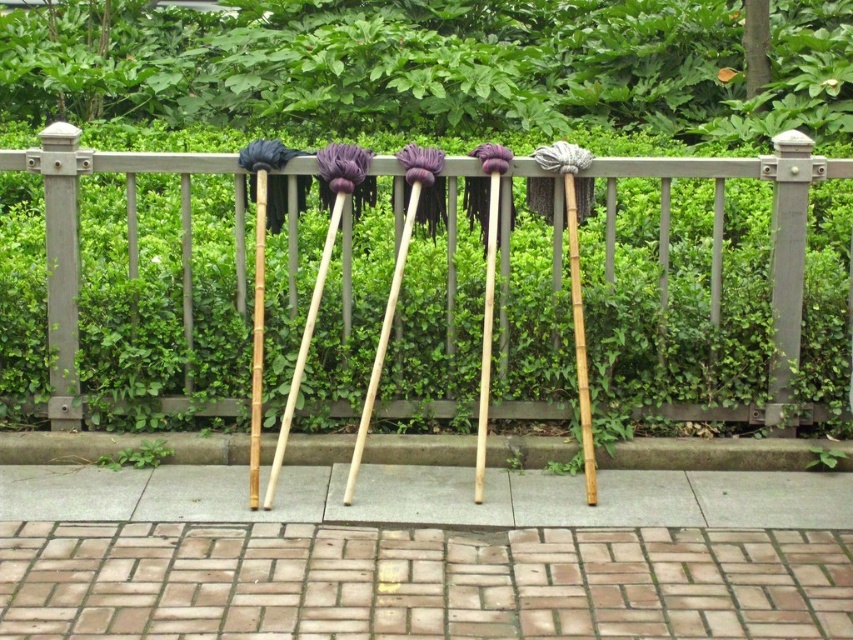
What do you see at coordinates (596, 291) in the screenshot?
I see `wooden fence at center` at bounding box center [596, 291].

Is wooden fence at center positioned in front of green leafy hedge at upper center?

Yes, wooden fence at center is in front of green leafy hedge at upper center.

Between point (152, 211) and point (521, 35), which one is positioned in front?

Positioned in front is point (152, 211).

Locate an element on the screen. The image size is (853, 640). wooden fence at center is located at coordinates (596, 291).

Between green leafy hedge at upper center and brick paving at lower center, which one is positioned lower?

brick paving at lower center

Is green leafy hedge at upper center shorter than brick paving at lower center?

No, green leafy hedge at upper center is not shorter than brick paving at lower center.

Does point (233, 12) lie behind point (219, 609)?

Yes, point (233, 12) is farther from viewer.

At what (x,y) coordinates should I click in order to perform the action: click on green leafy hedge at upper center. Please return your answer as a coordinate pair (x, y). The width and height of the screenshot is (853, 640). Looking at the image, I should click on (433, 65).

Does wooden fence at center have a greater height compared to brick paving at lower center?

Correct, wooden fence at center is much taller as brick paving at lower center.

In the scene shown: Does wooden fence at center lie behind brick paving at lower center?

Yes, wooden fence at center is behind brick paving at lower center.

You are a GUI agent. You are given a task and a screenshot of the screen. Output one action in this format:
    pyautogui.click(x=<x>, y=<y>)
    Task: Click on the wooden fence at center
    
    Given the screenshot: What is the action you would take?
    pyautogui.click(x=596, y=291)